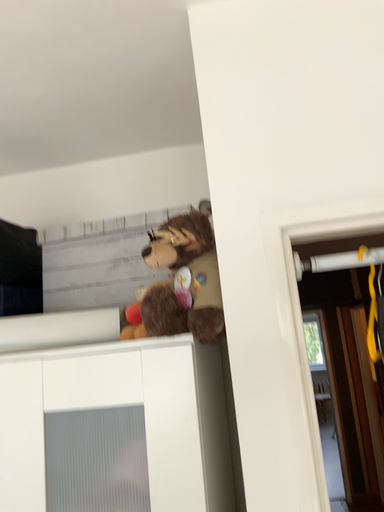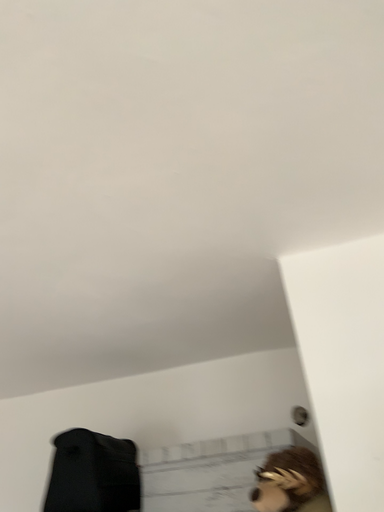
Question: Which way did the camera rotate in the video?

Choices:
 (A) rotated left
 (B) rotated right

Answer: (A)